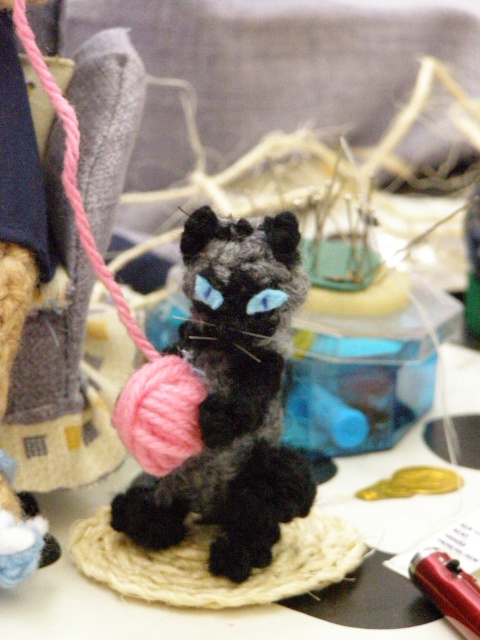
You have a small box that can only fit items wider than the red plastic pen at lower right. Can the black yarn ball at center fit into the box?

The black yarn ball at center is wider than the red plastic pen at lower right, so it can fit into the box if the box requires items wider than the pen.

Consider the image. You are an artist who needs to know the relative sizes of the objects in the scene to create a scaled drawing. Which object is taller between the black yarn ball at center and the red plastic pen at lower right?

The black yarn ball at center is taller than the red plastic pen at lower right.